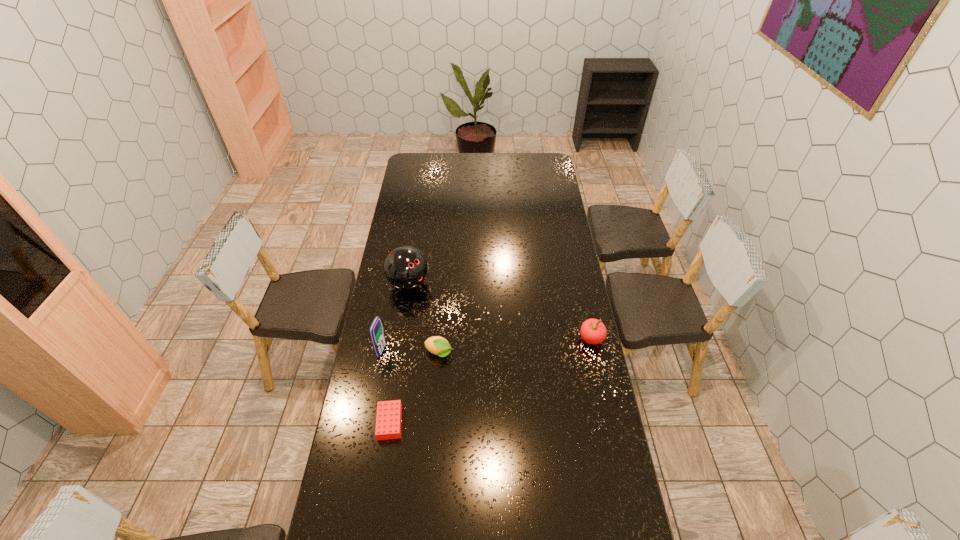
Where is `vacant space that satisfies the following two spatial constraints: 1. on the back side of the bowling ball; 2. on the right side of the cellular telephone`? vacant space that satisfies the following two spatial constraints: 1. on the back side of the bowling ball; 2. on the right side of the cellular telephone is located at coordinates (395, 283).

The width and height of the screenshot is (960, 540). Identify the location of blank space that satisfies the following two spatial constraints: 1. on the back side of the rightmost object; 2. on the right side of the shortest object. (402, 339).

Where is `free location that satisfies the following two spatial constraints: 1. on the back side of the second shortest object; 2. on the right side of the shortest object`? This screenshot has width=960, height=540. free location that satisfies the following two spatial constraints: 1. on the back side of the second shortest object; 2. on the right side of the shortest object is located at coordinates (400, 353).